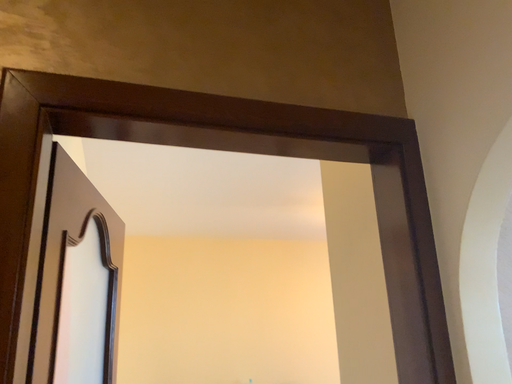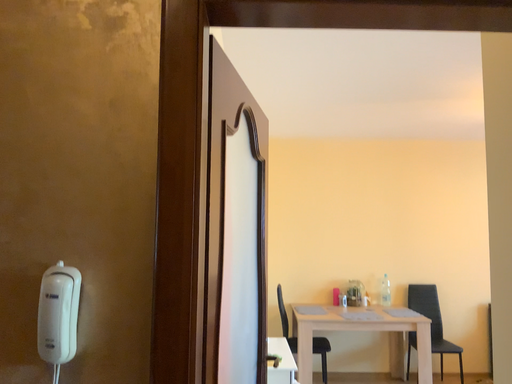
Question: Which way did the camera rotate in the video?

Choices:
 (A) rotated upward
 (B) rotated downward

Answer: (B)